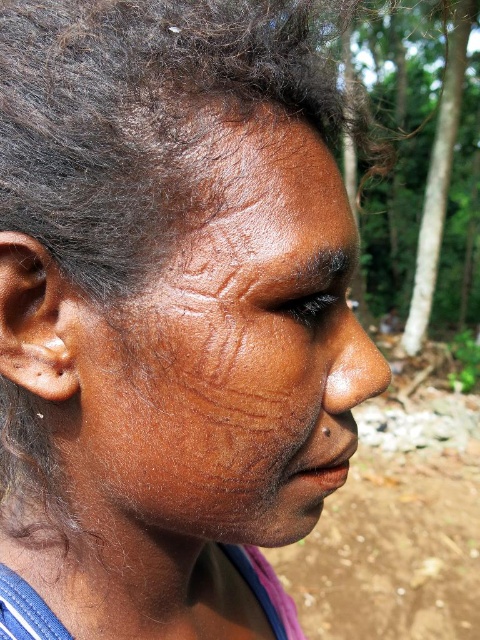
Is dry skin at upper center positioned before green leafy tree at upper right?

Yes, dry skin at upper center is closer to the viewer.

Can you confirm if dry skin at upper center is positioned above green leafy tree at upper right?

No, dry skin at upper center is not above green leafy tree at upper right.

Between point (241, 209) and point (428, 292), which one is positioned behind?

The point (428, 292) is more distant.

At what (x,y) coordinates should I click in order to perform the action: click on dry skin at upper center. Please return your answer as a coordinate pair (x, y). Looking at the image, I should click on (262, 173).

Is brown matte skin at center further to camera compared to dry skin at upper center?

No, it is not.

Is brown matte skin at center shorter than dry skin at upper center?

In fact, brown matte skin at center may be taller than dry skin at upper center.

Image resolution: width=480 pixels, height=640 pixels. Find the location of `brown matte skin at center`. brown matte skin at center is located at coordinates (229, 348).

Describe the element at coordinates (229, 348) in the screenshot. I see `brown matte skin at center` at that location.

Who is positioned more to the left, brown matte skin at center or green leafy tree at upper right?

Positioned to the left is brown matte skin at center.

Does point (264, 452) come behind point (410, 323)?

That is False.

Locate an element on the screen. brown matte skin at center is located at coordinates (229, 348).